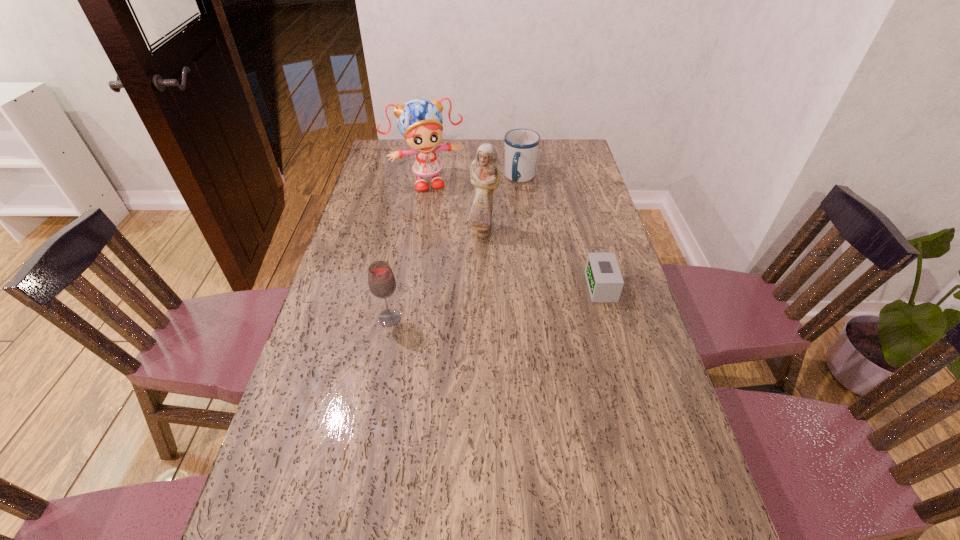
The width and height of the screenshot is (960, 540). Identify the location of empty location between the alarm clock and the second shortest object. (561, 232).

Locate an element on the screen. Image resolution: width=960 pixels, height=540 pixels. free space that is in between the doll and the alarm clock is located at coordinates (514, 234).

At what (x,y) coordinates should I click in order to perform the action: click on empty location between the rightmost object and the figurine. Please return your answer as a coordinate pair (x, y). The image size is (960, 540). Looking at the image, I should click on (542, 259).

This screenshot has height=540, width=960. I want to click on free space between the third farthest object and the nearest object, so click(x=437, y=275).

This screenshot has width=960, height=540. In order to click on unoccupied area between the nearest object and the third object from right to left in this screenshot , I will do `click(437, 275)`.

Find the location of a particular element. The height and width of the screenshot is (540, 960). free point between the shortest object and the glass drink container is located at coordinates (495, 302).

This screenshot has width=960, height=540. What are the coordinates of `free space between the nearest object and the third nearest object` in the screenshot? It's located at (437, 275).

I want to click on blank region between the third object from right to left and the alarm clock, so click(542, 259).

Point out which object is positioned as the nearest to the alarm clock. Please provide its 2D coordinates. Your answer should be formatted as a tuple, i.e. [(x, y)], where the tuple contains the x and y coordinates of a point satisfying the conditions above.

[(485, 172)]

Select which object appears as the second closest to the fourth tallest object. Please provide its 2D coordinates. Your answer should be formatted as a tuple, i.e. [(x, y)], where the tuple contains the x and y coordinates of a point satisfying the conditions above.

[(485, 172)]